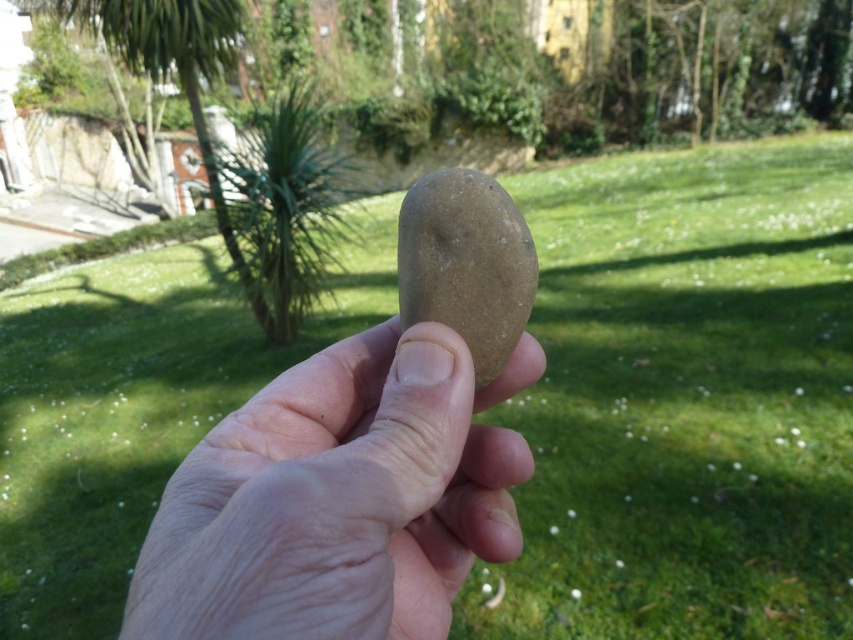
Which is below, smooth beige stone at center or smooth brown stone at center?

smooth beige stone at center is lower down.

Locate an element on the screen. The width and height of the screenshot is (853, 640). smooth beige stone at center is located at coordinates (339, 497).

Locate an element on the screen. smooth beige stone at center is located at coordinates (339, 497).

Is smooth beige stone at center thinner than green leafy palm tree at center?

Correct, smooth beige stone at center's width is less than green leafy palm tree at center's.

Who is more distant from viewer, [312,636] or [306,179]?

Positioned behind is point [306,179].

Who is more distant from viewer, (273, 420) or (314, 273)?

The point (314, 273) is more distant.

Where is `smooth beige stone at center`? smooth beige stone at center is located at coordinates (339, 497).

Can you confirm if green leafy palm tree at center is positioned below smooth brown stone at center?

Incorrect, green leafy palm tree at center is not positioned below smooth brown stone at center.

Can you confirm if green leafy palm tree at center is wider than smooth brown stone at center?

Correct, the width of green leafy palm tree at center exceeds that of smooth brown stone at center.

Does point (230, 156) come closer to viewer compared to point (450, 291)?

No, it is behind (450, 291).

I want to click on green leafy palm tree at center, so click(x=283, y=209).